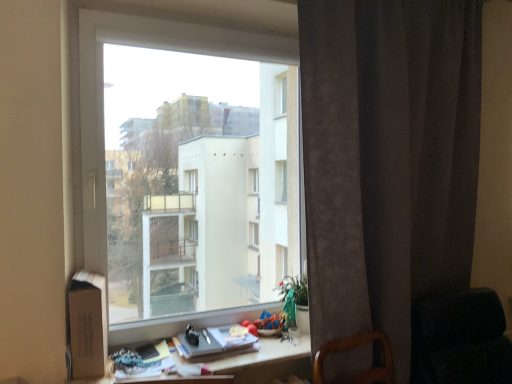
The height and width of the screenshot is (384, 512). Describe the element at coordinates (214, 341) in the screenshot. I see `matte gray book at lower center` at that location.

What do you see at coordinates (186, 170) in the screenshot? I see `transparent glass window at center` at bounding box center [186, 170].

The image size is (512, 384). Describe the element at coordinates (388, 159) in the screenshot. I see `dark gray velvet curtain at right` at that location.

The height and width of the screenshot is (384, 512). Describe the element at coordinates (260, 361) in the screenshot. I see `wooden desk at center` at that location.

Measure the distance between point (275, 366) and camera.

They are 1.78 meters apart.

I want to click on matte gray book at lower center, so click(x=214, y=341).

Is matte gray book at lower center taller or shorter than transparent glass window at center?

Clearly, matte gray book at lower center is shorter compared to transparent glass window at center.

Is transparent glass window at center located within matte gray book at lower center?

No, transparent glass window at center is not inside matte gray book at lower center.

Considering the relative sizes of matte gray book at lower center and transparent glass window at center in the image provided, is matte gray book at lower center wider than transparent glass window at center?

No.

Consider the image. Can you confirm if matte gray book at lower center is positioned to the right of transparent glass window at center?

Yes, matte gray book at lower center is to the right of transparent glass window at center.

Would you say wooden desk at center is a long distance from dark gray velvet curtain at right?

That's not correct — wooden desk at center is a little close to dark gray velvet curtain at right.

How different are the orientations of wooden desk at center and dark gray velvet curtain at right in degrees?

The angular difference between wooden desk at center and dark gray velvet curtain at right is 1.16 degrees.

Consider the image. From a real-world perspective, does wooden desk at center stand above dark gray velvet curtain at right?

Actually, wooden desk at center is physically below dark gray velvet curtain at right in the real world.

From the image's perspective, would you say wooden desk at center is shown under dark gray velvet curtain at right?

Yes, from the image's perspective, wooden desk at center is beneath dark gray velvet curtain at right.

Is transparent glass window at center oriented away from dark gray velvet curtain at right?

transparent glass window at center does not have its back to dark gray velvet curtain at right.

How far apart are transparent glass window at center and dark gray velvet curtain at right?

The distance of transparent glass window at center from dark gray velvet curtain at right is 23.82 inches.

Image resolution: width=512 pixels, height=384 pixels. I want to click on curtain beneath the transparent glass window at center (from a real-world perspective), so click(x=388, y=159).

Can we say transparent glass window at center lies outside dark gray velvet curtain at right?

transparent glass window at center lies outside dark gray velvet curtain at right's area.

Is wooden desk at center completely or partially outside of dark fabric rocking chair at lower right?

Absolutely, wooden desk at center is external to dark fabric rocking chair at lower right.

Is wooden desk at center far away from dark fabric rocking chair at lower right?

They are positioned close to each other.

How distant is wooden desk at center from dark fabric rocking chair at lower right?

wooden desk at center is 28.71 inches from dark fabric rocking chair at lower right.

Is dark fabric rocking chair at lower right looking in the opposite direction of transparent glass window at center?

That's not correct — dark fabric rocking chair at lower right is not looking away from transparent glass window at center.

From the picture: Are dark fabric rocking chair at lower right and transparent glass window at center located far from each other?

Yes, dark fabric rocking chair at lower right and transparent glass window at center are located far from each other.

Does dark fabric rocking chair at lower right appear on the right side of transparent glass window at center?

Correct, you'll find dark fabric rocking chair at lower right to the right of transparent glass window at center.

Locate an element on the screen. Image resolution: width=512 pixels, height=384 pixels. book above the dark fabric rocking chair at lower right (from the image's perspective) is located at coordinates (214, 341).

From a real-world perspective, which is physically below, matte gray book at lower center or dark fabric rocking chair at lower right?

In real-world perspective, dark fabric rocking chair at lower right is lower.

In the scene shown: Which is behind, matte gray book at lower center or dark fabric rocking chair at lower right?

matte gray book at lower center is further away from the camera.

Between matte gray book at lower center and dark fabric rocking chair at lower right, which one has less height?

matte gray book at lower center is shorter.

From the image's perspective, is dark gray velvet curtain at right over wooden desk at center?

Correct, dark gray velvet curtain at right appears higher than wooden desk at center in the image.

Between dark gray velvet curtain at right and wooden desk at center, which one has more height?

dark gray velvet curtain at right is taller.

From a real-world perspective, relative to wooden desk at center, is dark gray velvet curtain at right vertically above or below?

Clearly, from a real-world perspective, dark gray velvet curtain at right is above wooden desk at center.

Identify the location of book below the transparent glass window at center (from the image's perspective). This screenshot has height=384, width=512. pos(214,341).

Find the location of a particular element. The image size is (512, 384). curtain located behind the wooden desk at center is located at coordinates (388, 159).

Looking at the image, which one is located closer to matte gray book at lower center, wooden desk at center or dark gray velvet curtain at right?

wooden desk at center.

Based on their spatial positions, is matte gray book at lower center or wooden desk at center further from dark gray velvet curtain at right?

The object further to dark gray velvet curtain at right is matte gray book at lower center.

Which object lies further to the anchor point wooden desk at center, dark gray velvet curtain at right or transparent glass window at center?

Among the two, transparent glass window at center is located further to wooden desk at center.

Based on their spatial positions, is dark fabric rocking chair at lower right or matte gray book at lower center closer to transparent glass window at center?

Among the two, matte gray book at lower center is located nearer to transparent glass window at center.

Estimate the real-world distances between objects in this image. Which object is further from transparent glass window at center, dark gray velvet curtain at right or wooden desk at center?

The object further to transparent glass window at center is wooden desk at center.

When comparing their distances from dark fabric rocking chair at lower right, does matte gray book at lower center or transparent glass window at center seem further?

Among the two, transparent glass window at center is located further to dark fabric rocking chair at lower right.

From the image, which object appears to be farther from dark gray velvet curtain at right, matte gray book at lower center or dark fabric rocking chair at lower right?

The object further to dark gray velvet curtain at right is matte gray book at lower center.

Considering their positions, is wooden desk at center positioned further to dark gray velvet curtain at right than transparent glass window at center?

wooden desk at center lies further to dark gray velvet curtain at right than the other object.

At what (x,y) coordinates should I click in order to perform the action: click on book between wooden desk at center and dark fabric rocking chair at lower right in the horizontal direction. Please return your answer as a coordinate pair (x, y). Looking at the image, I should click on (214, 341).

Image resolution: width=512 pixels, height=384 pixels. I want to click on book between transparent glass window at center and wooden desk at center in the vertical direction, so click(214, 341).

At what (x,y) coordinates should I click in order to perform the action: click on desk between transparent glass window at center and dark gray velvet curtain at right in the horizontal direction. Please return your answer as a coordinate pair (x, y). Looking at the image, I should click on (260, 361).

The width and height of the screenshot is (512, 384). I want to click on curtain located between transparent glass window at center and dark fabric rocking chair at lower right in the left-right direction, so click(388, 159).